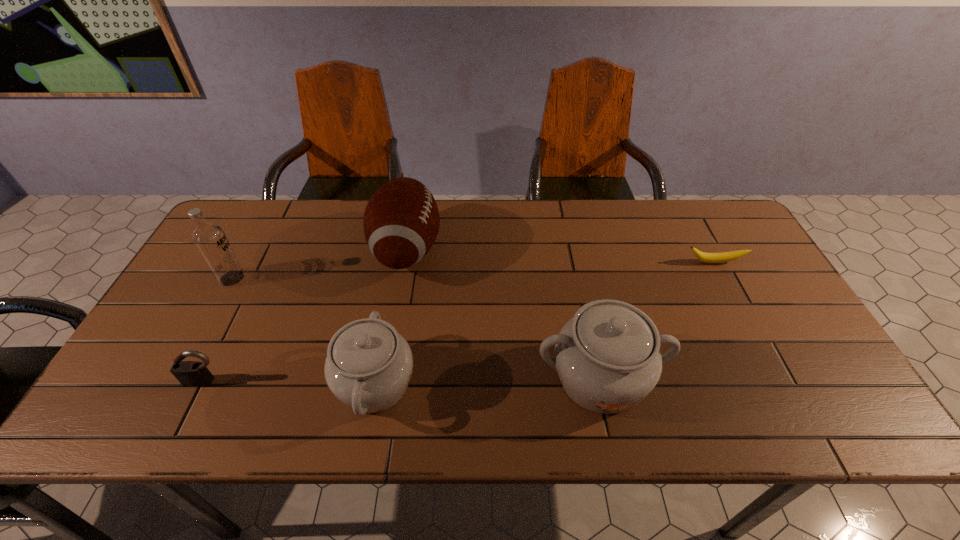
I want to click on empty location between the padlock and the vodka, so click(219, 330).

The image size is (960, 540). I want to click on vacant area that lies between the shortest object and the football, so coord(561,255).

I want to click on free space between the padlock and the vodka, so click(219, 330).

I want to click on free area in between the third shortest object and the padlock, so click(x=290, y=383).

Find the location of a particular element. The image size is (960, 540). free space that is in between the banana and the second shortest object is located at coordinates (460, 322).

Where is `object that stands as the fifth closest to the second shortest object`? The height and width of the screenshot is (540, 960). object that stands as the fifth closest to the second shortest object is located at coordinates (721, 257).

The height and width of the screenshot is (540, 960). I want to click on object identified as the closest to the left chinaware, so click(x=401, y=221).

Identify the location of free space that satisfies the following two spatial constraints: 1. on the laces of the football; 2. with the keyhole on the front of the padlock. The width and height of the screenshot is (960, 540). (384, 381).

I want to click on free space that satisfies the following two spatial constraints: 1. on the upward curve of the shortest object; 2. on the front label of the vodka, so click(x=724, y=279).

At what (x,y) coordinates should I click in order to perform the action: click on vacant position in the image that satisfies the following two spatial constraints: 1. on the upward curve of the banana; 2. on the front label of the vodka. Please return your answer as a coordinate pair (x, y). Looking at the image, I should click on (724, 279).